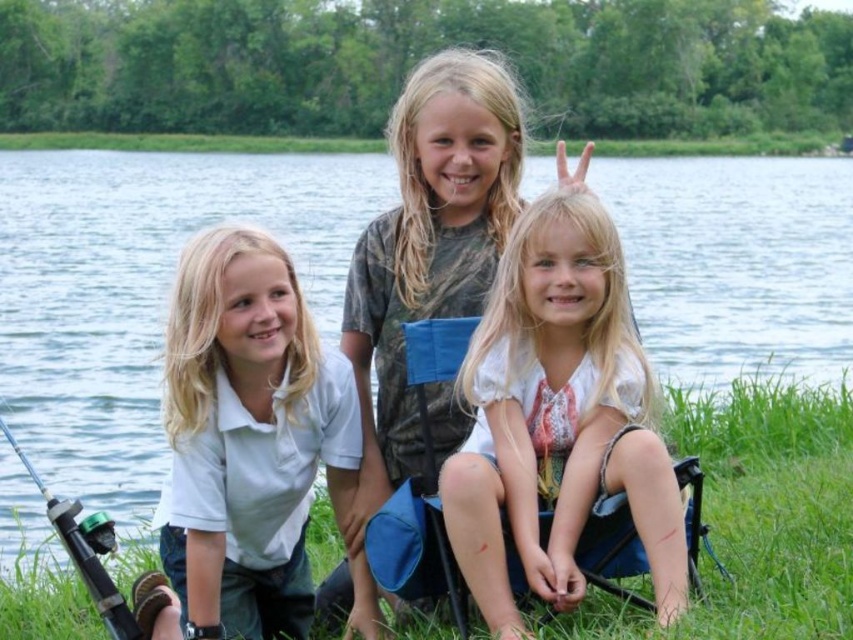
Question: Is white cotton shirt at left wider than green plastic fishing pole at lower left?

Choices:
 (A) yes
 (B) no

Answer: (A)

Question: In this image, where is green grass at lower center located relative to green plastic fishing pole at lower left?

Choices:
 (A) above
 (B) below

Answer: (B)

Question: Which point appears closest to the camera in this image?

Choices:
 (A) 636,301
 (B) 129,637
 (C) 230,401
 (D) 807,442

Answer: (B)

Question: Which of these objects is positioned farthest from the white lace shirt at center?

Choices:
 (A) green grass at lower center
 (B) white cotton shirt at left

Answer: (A)

Question: Based on their relative distances, which object is farther from the white lace shirt at center?

Choices:
 (A) green plastic fishing pole at lower left
 (B) green grass at lower center
 (C) white cotton shirt at left
 (D) clear blue water at center

Answer: (D)

Question: Observing the image, what is the correct spatial positioning of clear blue water at center in reference to white cotton shirt at left?

Choices:
 (A) left
 (B) right

Answer: (B)